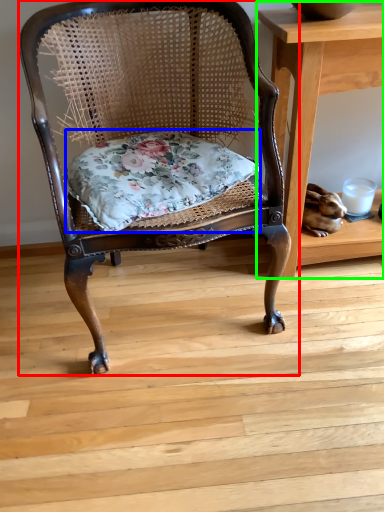
Question: Which object is positioned farthest from chair (highlighted by a red box)? Select from pillow (highlighted by a blue box) and table (highlighted by a green box).

Choices:
 (A) pillow
 (B) table

Answer: (B)